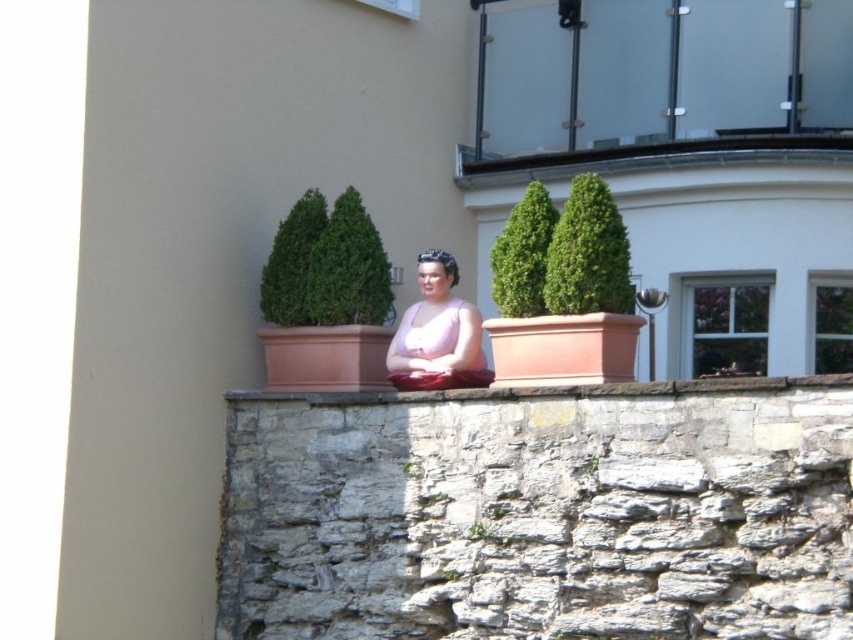
Question: Is pink matte dress at center to the right of stone ledge at center from the viewer's perspective?

Choices:
 (A) yes
 (B) no

Answer: (B)

Question: Is pink matte dress at center to the right of stone ledge at center from the viewer's perspective?

Choices:
 (A) yes
 (B) no

Answer: (B)

Question: Is pink matte dress at center wider than stone ledge at center?

Choices:
 (A) no
 (B) yes

Answer: (A)

Question: Which object is farther from the camera taking this photo?

Choices:
 (A) pink matte dress at center
 (B) stone ledge at center

Answer: (A)